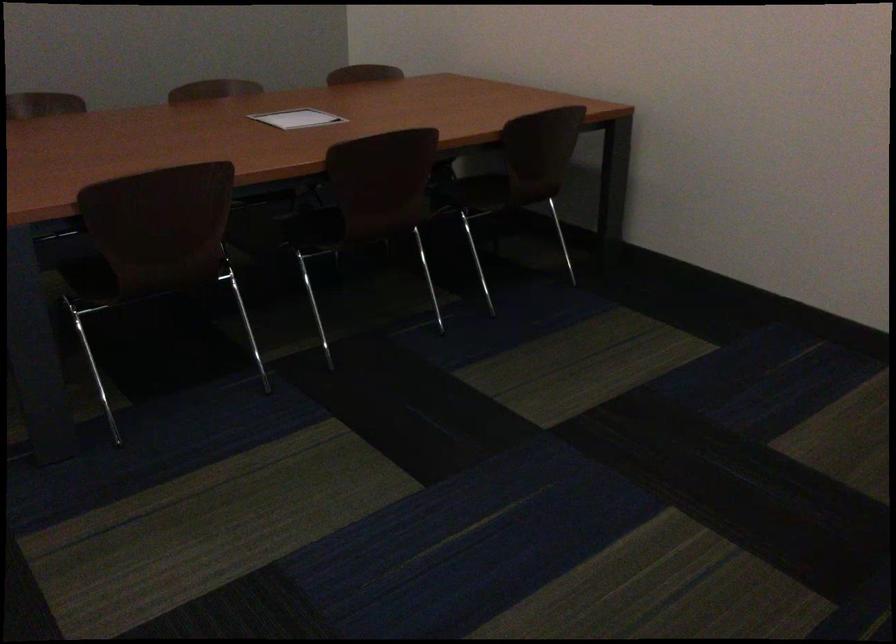
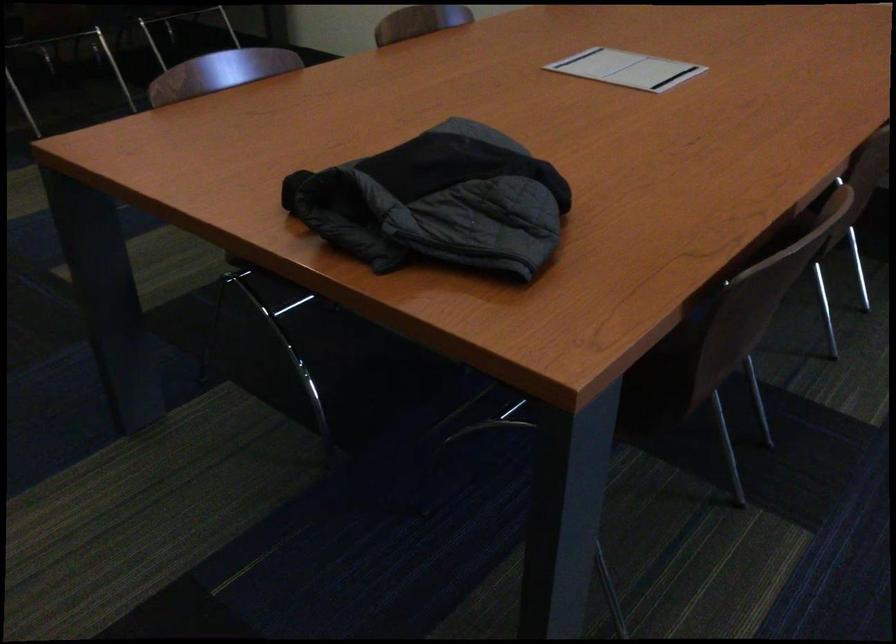
From the picture: Which direction would the cameraman need to move to produce the second image?

The cameraman moved toward right, backward.